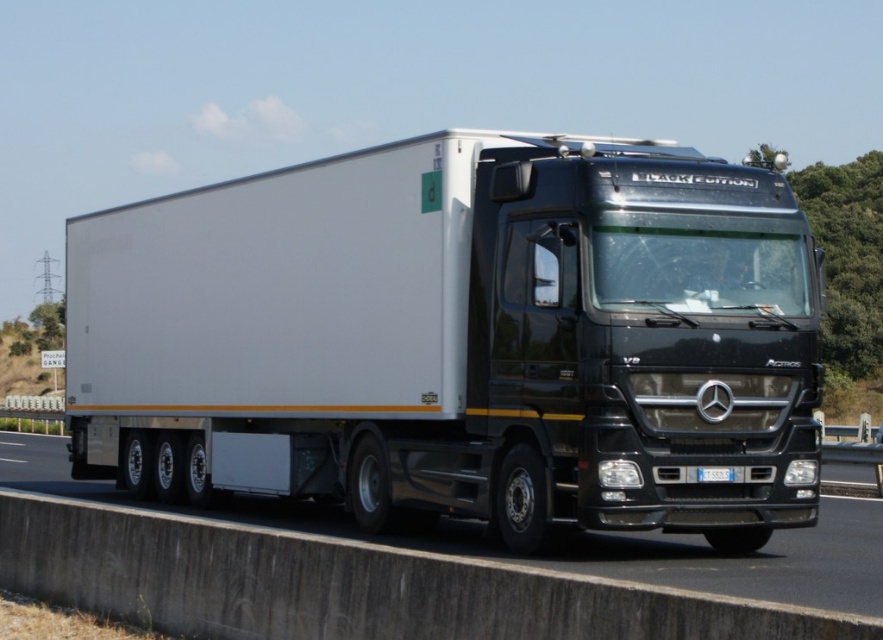
You are a truck driver planning to pass another vehicle on the highway. You notice the white glossy trailer at center and the black glossy truck at center in your path. Given their widths, which one would require more caution when passing due to its narrower width?

The white glossy trailer at center has a narrower width than the black glossy truck at center, so it would require more caution when passing because its narrower width might make it harder to judge the distance and maintain a safe clearance.

You are a photographer trying to capture the black glossy truck at center and the white plastic license plate at center in a single shot. Since the truck is larger, will the license plate still be visible in the photo?

The black glossy truck at center is bigger than the white plastic license plate at center, so the license plate will still be visible but smaller in the photo.

You are a photographer trying to capture the black glossy truck at center and the white plastic license plate at center in a single shot. Since the truck is wider than the license plate, which object will occupy more space in the photo?

The black glossy truck at center will occupy more space in the photo because its width surpasses that of the white plastic license plate at center.